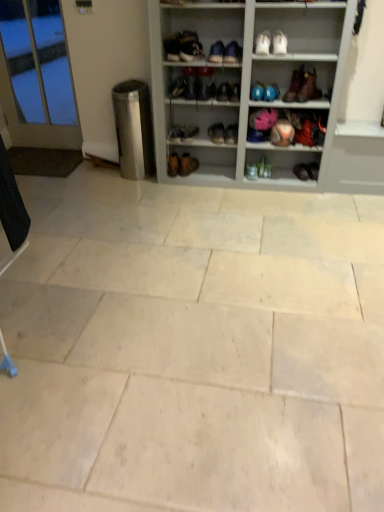
Question: From the image's perspective, is blue matte bowling ball at upper center, the second shoe viewed from the right, beneath natural stone tile at center?

Choices:
 (A) no
 (B) yes

Answer: (A)

Question: From a real-world perspective, does blue matte bowling ball at upper center, the second shoe viewed from the right, sit lower than natural stone tile at center?

Choices:
 (A) no
 (B) yes

Answer: (A)

Question: Is the position of blue matte bowling ball at upper center, the second shoe viewed from the right, less distant than that of natural stone tile at center?

Choices:
 (A) no
 (B) yes

Answer: (A)

Question: Does blue matte bowling ball at upper center, the second shoe viewed from the right, have a smaller size compared to natural stone tile at center?

Choices:
 (A) no
 (B) yes

Answer: (B)

Question: Is the depth of blue matte bowling ball at upper center, the second shoe viewed from the right, greater than that of natural stone tile at center?

Choices:
 (A) no
 (B) yes

Answer: (B)

Question: Does blue matte bowling ball at upper center, placed as the 5th shoe when sorted from left to right, have a greater width compared to natural stone tile at center?

Choices:
 (A) no
 (B) yes

Answer: (A)

Question: Is matte black shoe at center, acting as the first footwear starting from the right, located outside matte pink shoe at upper right, positioned as the 3th footwear in right-to-left order?

Choices:
 (A) no
 (B) yes

Answer: (B)

Question: From a real-world perspective, is matte black shoe at center, the tenth footwear from the left, physically above matte pink shoe at upper right, which appears as the eighth footwear when viewed from the left?

Choices:
 (A) yes
 (B) no

Answer: (B)

Question: From a real-world perspective, does matte black shoe at center, the tenth footwear from the left, sit lower than matte pink shoe at upper right, which appears as the eighth footwear when viewed from the left?

Choices:
 (A) no
 (B) yes

Answer: (B)

Question: Does matte black shoe at center, the tenth footwear from the left, have a lesser height compared to matte pink shoe at upper right, positioned as the 3th footwear in right-to-left order?

Choices:
 (A) no
 (B) yes

Answer: (B)

Question: Is matte pink shoe at upper right, which appears as the eighth footwear when viewed from the left, surrounded by matte black shoe at center, the tenth footwear from the left?

Choices:
 (A) yes
 (B) no

Answer: (B)

Question: Considering the relative sizes of matte black shoe at center, acting as the first footwear starting from the right, and matte pink shoe at upper right, positioned as the 3th footwear in right-to-left order, in the image provided, is matte black shoe at center, acting as the first footwear starting from the right, thinner than matte pink shoe at upper right, positioned as the 3th footwear in right-to-left order,?

Choices:
 (A) yes
 (B) no

Answer: (A)

Question: Considering the relative positions of white leather shoe at upper center, which is the second shoe from left to right, and natural stone tile at center in the image provided, is white leather shoe at upper center, which is the second shoe from left to right, to the left of natural stone tile at center from the viewer's perspective?

Choices:
 (A) yes
 (B) no

Answer: (B)